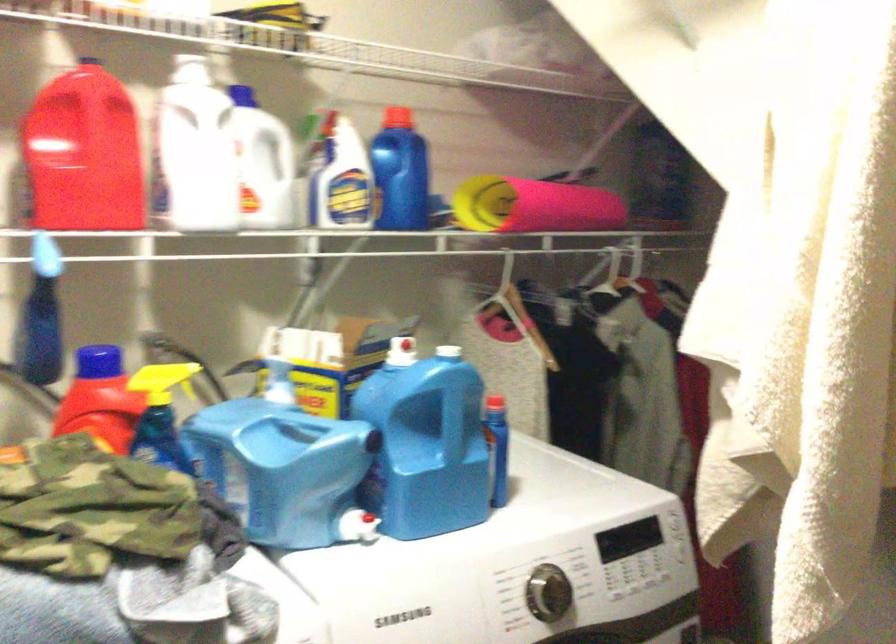
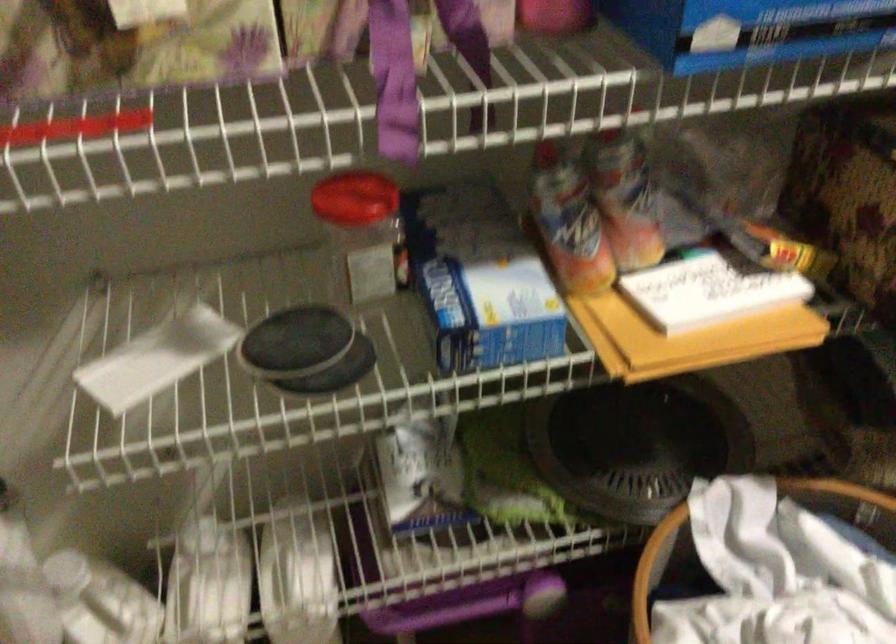
Based on the continuous images, in which direction is the camera rotating?

The rotation direction of the camera is left-down.